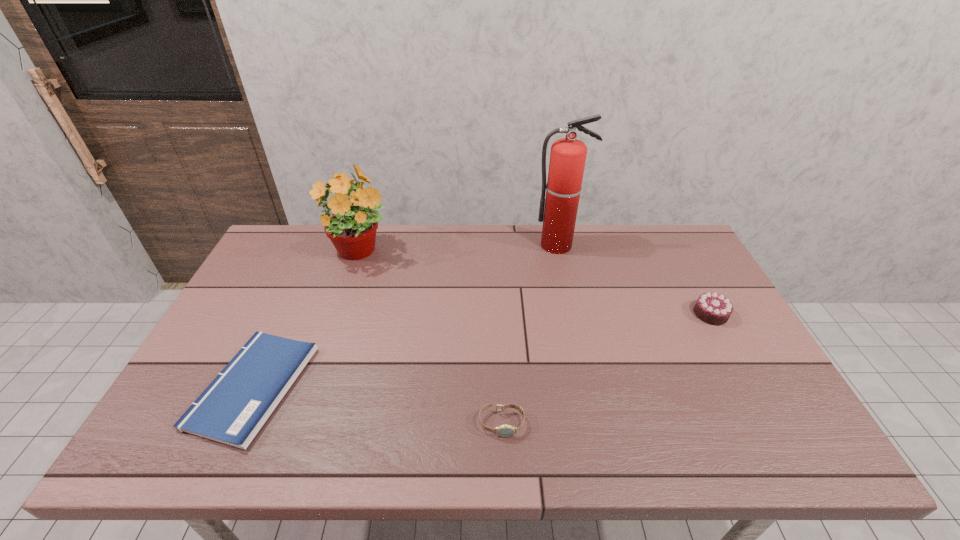
I want to click on vacant area between the watch and the flowerpot, so click(430, 338).

The height and width of the screenshot is (540, 960). I want to click on empty location between the fourth shortest object and the paperback book, so click(x=306, y=320).

I want to click on free space between the fourth shortest object and the watch, so click(430, 338).

Where is `vacant region between the paperback book and the watch`? This screenshot has width=960, height=540. vacant region between the paperback book and the watch is located at coordinates (377, 405).

Image resolution: width=960 pixels, height=540 pixels. I want to click on the closest object relative to the fire extinguisher, so click(x=712, y=308).

Locate an element on the screen. object that is the fourth closest to the shortest object is located at coordinates (712, 308).